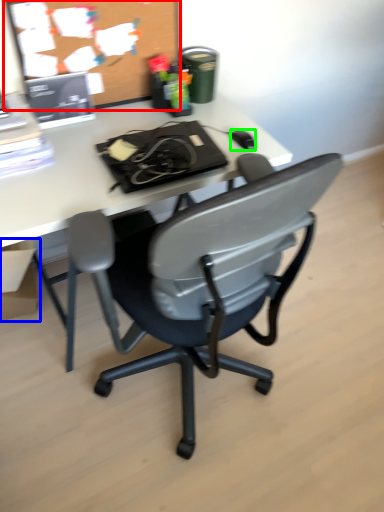
Question: Which object is positioned farthest from bulletin board (highlighted by a red box)? Select from box (highlighted by a blue box) and mouse (highlighted by a green box).

Choices:
 (A) box
 (B) mouse

Answer: (A)